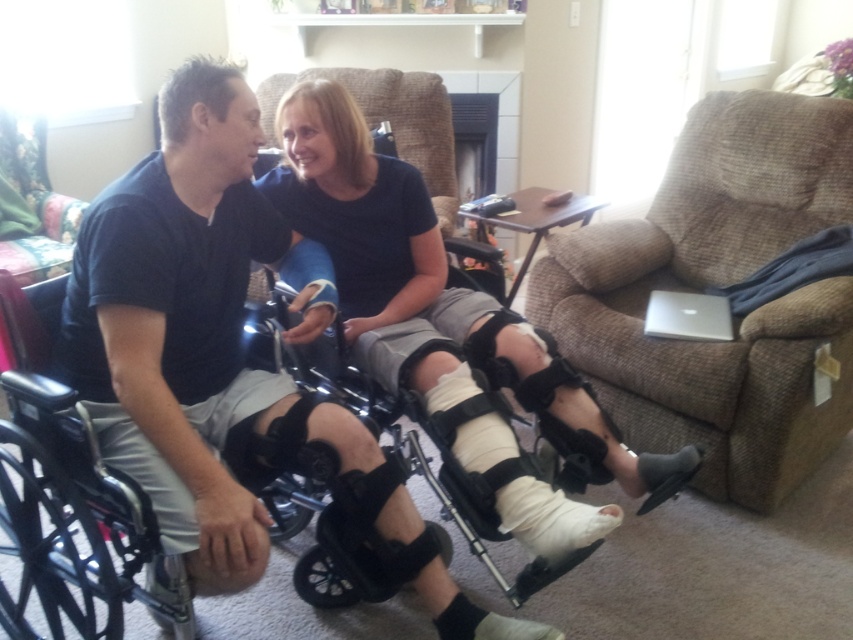
Question: Which is farther from the white bandaged leg at center?

Choices:
 (A) brown fabric armchair at right
 (B) black plastic wheelchair at left
 (C) white matte plaster bandage at lower center

Answer: (A)

Question: In this image, where is white bandaged leg at center located relative to black plastic wheelchair at left?

Choices:
 (A) right
 (B) left

Answer: (A)

Question: In this image, where is brown fabric armchair at right located relative to black plastic wheelchair at left?

Choices:
 (A) above
 (B) below

Answer: (A)

Question: Estimate the real-world distances between objects in this image. Which object is closer to the white matte plaster bandage at lower center?

Choices:
 (A) brown fabric armchair at right
 (B) white bandaged leg at center
 (C) black plastic wheelchair at left

Answer: (B)

Question: Which is nearer to the white bandaged leg at center?

Choices:
 (A) black plastic wheelchair at left
 (B) brown fabric armchair at right

Answer: (A)

Question: Does brown fabric armchair at right have a larger size compared to black plastic wheelchair at left?

Choices:
 (A) yes
 (B) no

Answer: (B)